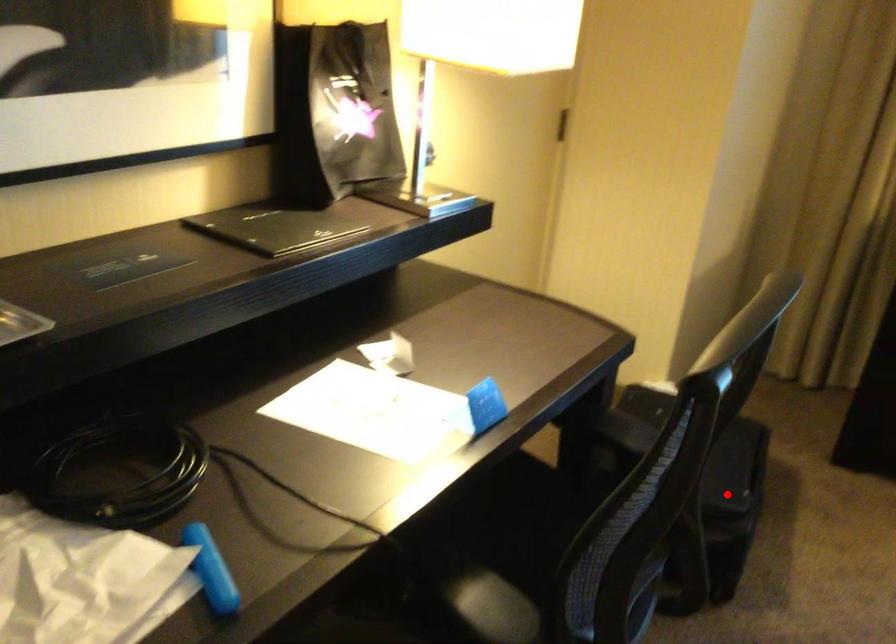
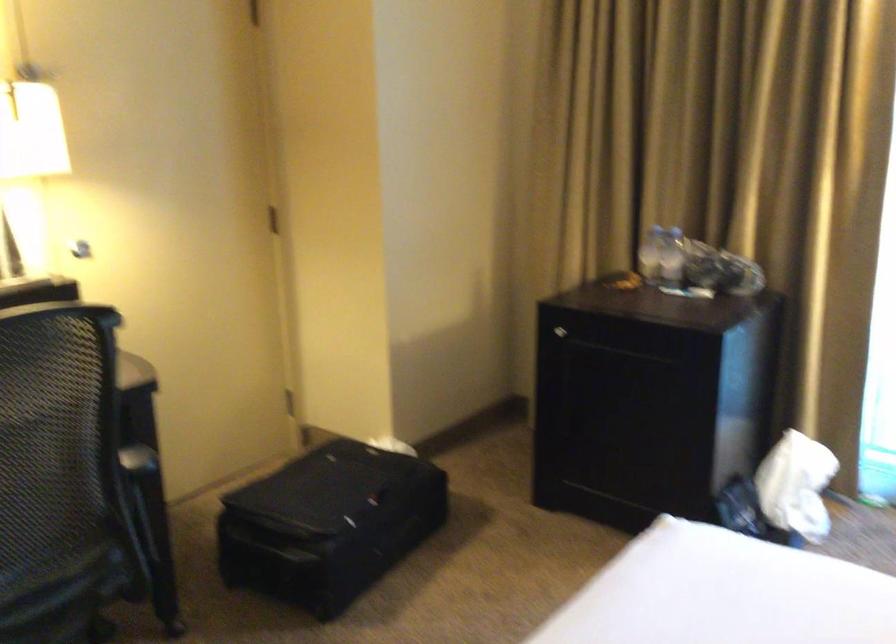
Find the pixel in the second image that matches the highlighted location in the first image.

(328, 524)